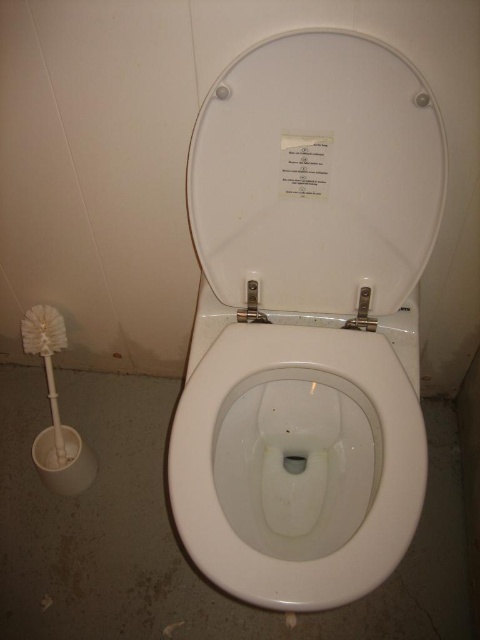
Question: Which object is the closest to the white glossy toilet bowl at center?

Choices:
 (A) white paper at center
 (B) white plastic toilet paper at lower left
 (C) white glossy toilet lid at center

Answer: (C)

Question: Can you confirm if white glossy toilet lid at center is positioned to the right of white plastic toilet paper at lower left?

Choices:
 (A) yes
 (B) no

Answer: (A)

Question: Among these points, which one is farthest from the camera?

Choices:
 (A) (49, 349)
 (B) (299, 154)
 (C) (372, 413)
 (D) (67, 467)

Answer: (A)

Question: Can you confirm if white plastic toilet paper at lower left is positioned below white plastic toilet brush at left?

Choices:
 (A) yes
 (B) no

Answer: (A)

Question: Is white glossy toilet bowl at center closer to camera compared to white plastic toilet brush at left?

Choices:
 (A) yes
 (B) no

Answer: (A)

Question: Which is nearer to the white plastic toilet paper at lower left?

Choices:
 (A) white glossy toilet lid at center
 (B) white glossy toilet at center
 (C) white glossy toilet bowl at center

Answer: (C)